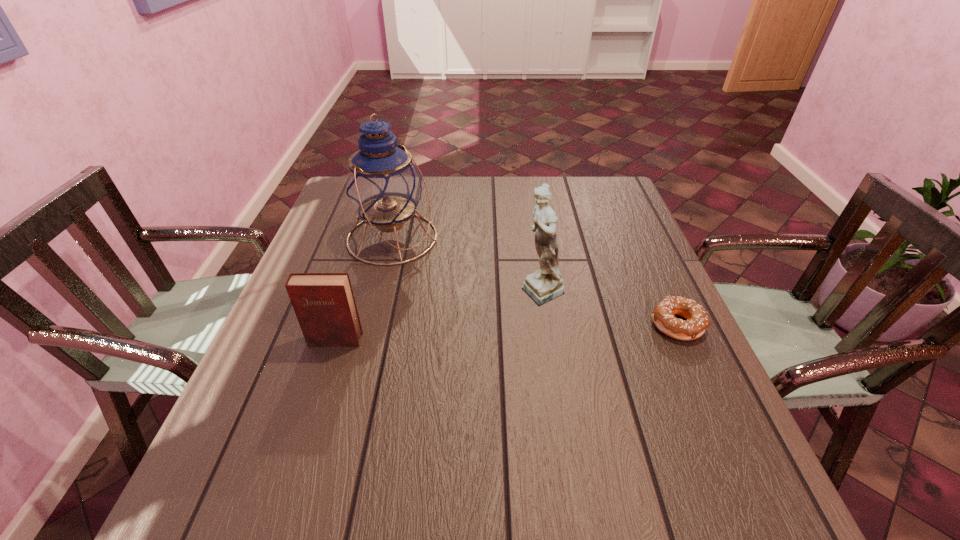
What are the coordinates of `empty space that is in between the figurine and the lantern` in the screenshot? It's located at (468, 265).

Where is `the closest object to the lantern`? This screenshot has width=960, height=540. the closest object to the lantern is located at coordinates (545, 284).

Locate which object is the second closest to the farthest object. Please provide its 2D coordinates. Your answer should be formatted as a tuple, i.e. [(x, y)], where the tuple contains the x and y coordinates of a point satisfying the conditions above.

[(324, 304)]